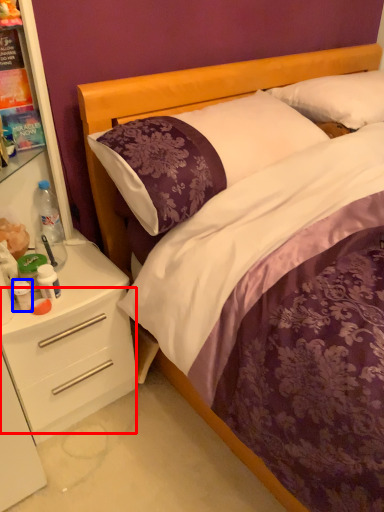
Question: Which of the following is the farthest to the observer, drawer (highlighted by a red box) or bottle (highlighted by a blue box)?

Choices:
 (A) drawer
 (B) bottle

Answer: (B)